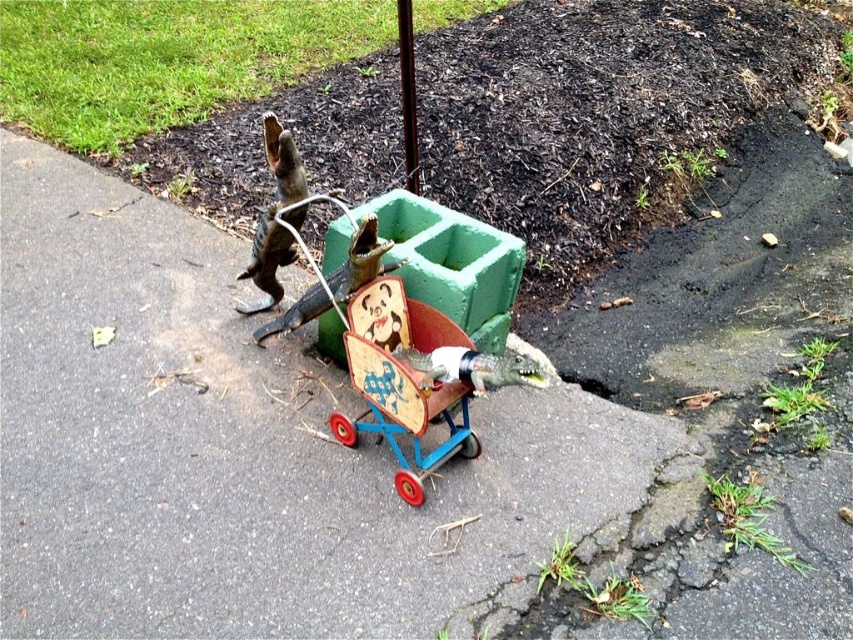
Question: Among these points, which one is farthest from the camera?

Choices:
 (A) (152, 212)
 (B) (389, 378)

Answer: (A)

Question: Is the position of smooth asphalt pavement at center less distant than that of wooden toy cart at center?

Choices:
 (A) yes
 (B) no

Answer: (A)

Question: Does smooth asphalt pavement at center have a greater width compared to wooden toy cart at center?

Choices:
 (A) no
 (B) yes

Answer: (B)

Question: From the image, what is the correct spatial relationship of smooth asphalt pavement at center in relation to wooden toy cart at center?

Choices:
 (A) above
 (B) below

Answer: (A)